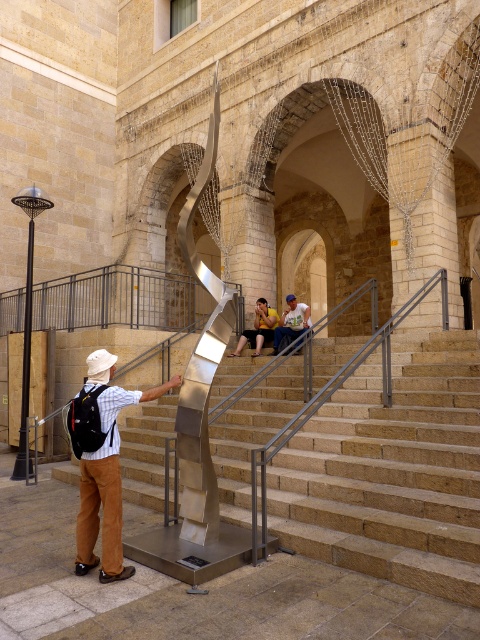
Question: Which point is farther to the camera?

Choices:
 (A) white t-shirt at center
 (B) smooth stone stairs at center
 (C) yellow t-shirt at center

Answer: (A)

Question: Observing the image, what is the correct spatial positioning of smooth stone stairs at center in reference to matte khaki pants at lower left?

Choices:
 (A) left
 (B) right

Answer: (B)

Question: Does smooth stone stairs at center appear on the left side of white t-shirt at center?

Choices:
 (A) no
 (B) yes

Answer: (A)

Question: Can you confirm if smooth stone stairs at center is thinner than matte khaki pants at lower left?

Choices:
 (A) yes
 (B) no

Answer: (B)

Question: Estimate the real-world distances between objects in this image. Which object is closer to the yellow t-shirt at center?

Choices:
 (A) smooth stone stairs at center
 (B) matte khaki pants at lower left

Answer: (A)

Question: Estimate the real-world distances between objects in this image. Which object is closer to the yellow t-shirt at center?

Choices:
 (A) white t-shirt at center
 (B) smooth stone stairs at center
 (C) matte khaki pants at lower left

Answer: (A)